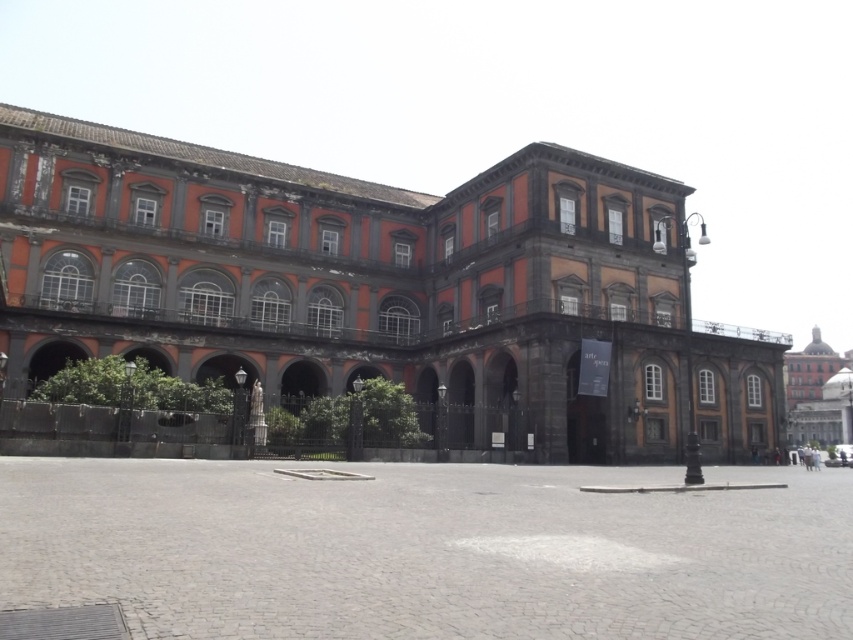
Based on the scene description, which building is positioned to the left when looking at the red brick building at center and the dark gray stone building at center?

The red brick building at center is to the left of the dark gray stone building at center.

You are standing in front of a historical building complex. You see the red brick building at center and the dark gray stone building at center. Which one is closer to you?

The red brick building at center is closer to you since it is in front of the dark gray stone building at center.

You are standing in front of a grand historical building. You want to take a photo of the red brick building at center. To ensure the building is centered in your photo, where should you position yourself relative to the building?

To center the red brick building at center in your photo, you should position yourself directly in front of the building, aligned with its central axis, as its 2D location is at point coordinates of [380,285].